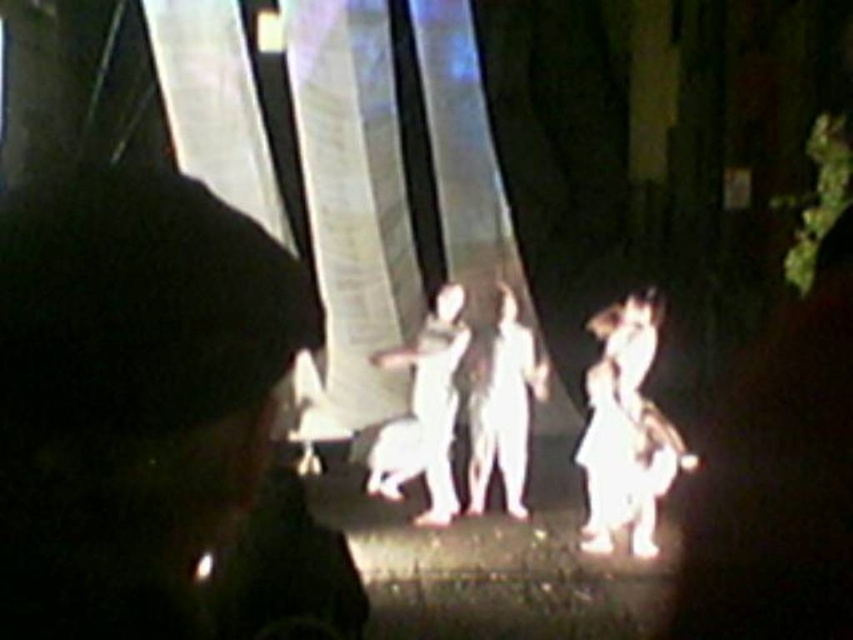
You are standing in the dark scene and want to move from the point closer to you to the point further away. Which path would you take between the two points, point (241, 262) and point (509, 465)?

The point closer to the viewer is point (241, 262), so you should move from point (241, 262) to point (509, 465) to reach the further point.